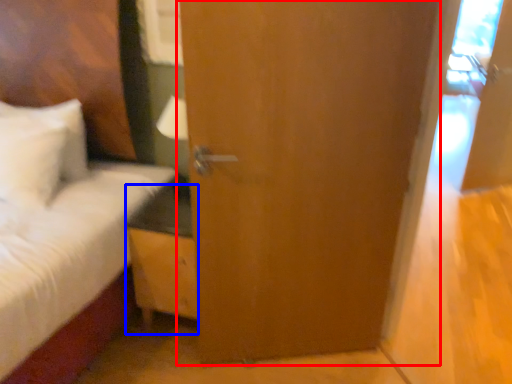
Question: Which object appears farthest to the camera in this image, door (highlighted by a red box) or nightstand (highlighted by a blue box)?

Choices:
 (A) door
 (B) nightstand

Answer: (B)